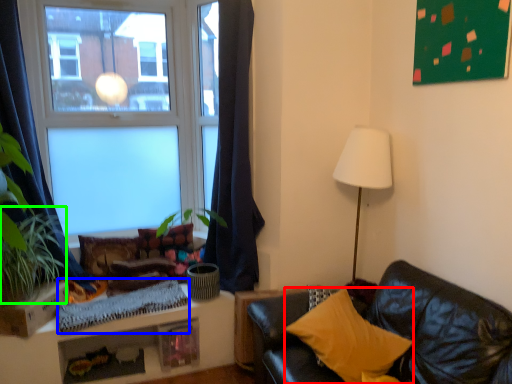
Question: Which is farther away from pillow (highlighted by a red box)? blanket (highlighted by a blue box) or plant (highlighted by a green box)?

Choices:
 (A) blanket
 (B) plant

Answer: (B)